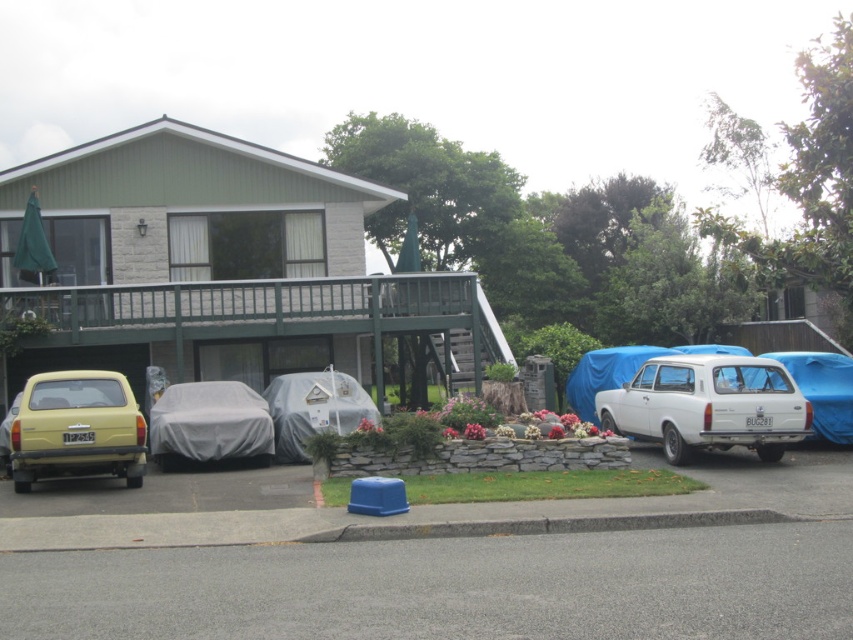
How far apart are white matte station wagon at right and matte yellow car at left?

They are 9.04 meters apart.

Is white matte station wagon at right smaller than matte yellow car at left?

Actually, white matte station wagon at right might be larger than matte yellow car at left.

Find the location of a particular element. The height and width of the screenshot is (640, 853). white matte station wagon at right is located at coordinates (708, 404).